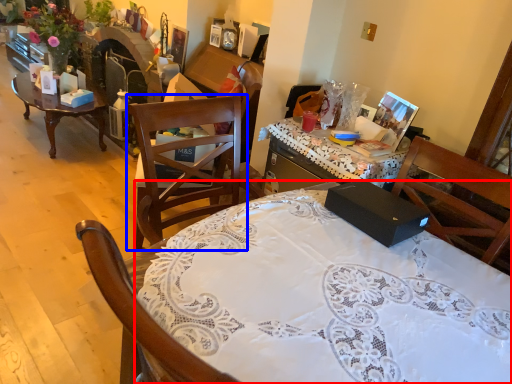
Question: Among these objects, which one is nearest to the camera, desk (highlighted by a red box) or chair (highlighted by a blue box)?

Choices:
 (A) desk
 (B) chair

Answer: (A)